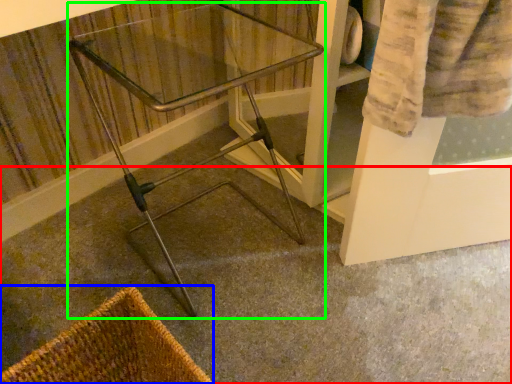
Question: Based on their relative distances, which object is farther from concrete (highlighted by a red box)? Choose from basket (highlighted by a blue box) and furniture (highlighted by a green box).

Choices:
 (A) basket
 (B) furniture

Answer: (A)